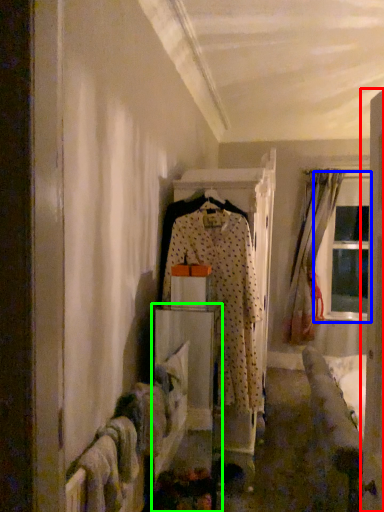
Question: Which object is positioned closest to door (highlighted by a red box)? Select from window (highlighted by a blue box) and furniture (highlighted by a green box).

Choices:
 (A) window
 (B) furniture

Answer: (B)